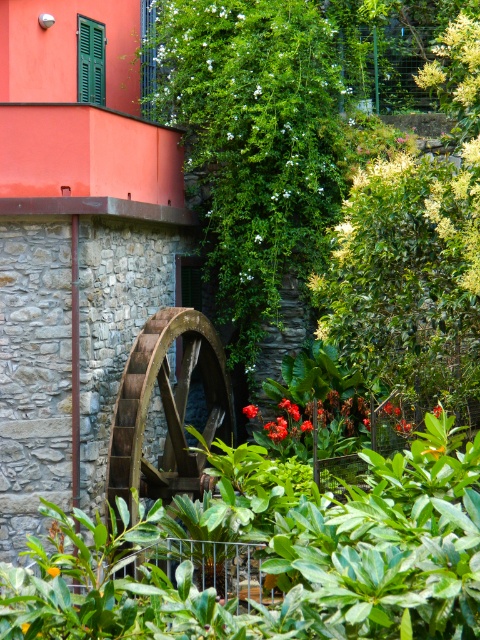
Can you confirm if vivid red petals at center is taller than orange matte flower at center?

Indeed, vivid red petals at center has a greater height compared to orange matte flower at center.

Does vivid red petals at center have a lesser height compared to orange matte flower at center?

No, vivid red petals at center is not shorter than orange matte flower at center.

Locate an element on the screen. The width and height of the screenshot is (480, 640). vivid red petals at center is located at coordinates (251, 410).

Where is `brown wooden wheel at center`? The width and height of the screenshot is (480, 640). brown wooden wheel at center is located at coordinates (168, 408).

This screenshot has width=480, height=640. Identify the location of brown wooden wheel at center. (168, 408).

Does green matte shutter at upper left have a larger size compared to orange matte flower at center?

Yes.

Which is behind, point (95, 36) or point (56, 576)?

Positioned behind is point (95, 36).

Locate an element on the screen. The image size is (480, 640). green matte shutter at upper left is located at coordinates (91, 60).